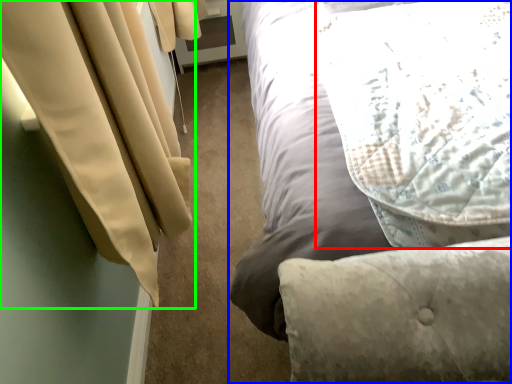
Question: Which object is positioned closest to pillow (highlighted by a red box)? Select from bed (highlighted by a blue box) and curtain (highlighted by a green box).

Choices:
 (A) bed
 (B) curtain

Answer: (A)